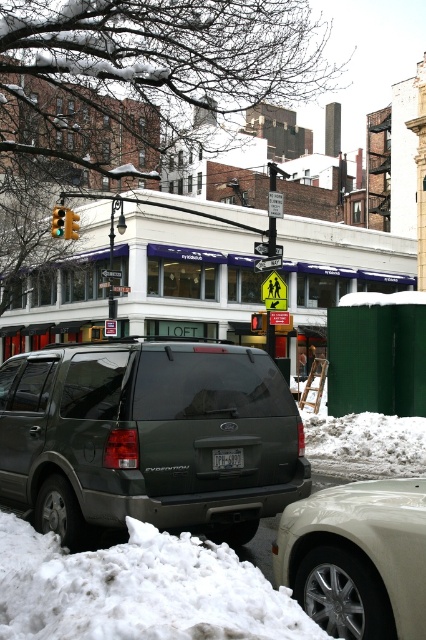
You are a delivery drone trying to deliver a package to the address on the black plastic license plate at rear. The GPS coordinates for the license plate are at point 0.717, 0.533. Can you confirm if this is the correct location to drop the package?

The black plastic license plate at rear is located at point (227,458), so the GPS coordinates are correct for dropping the package there.

You are standing on the sidewalk and want to take a photo of the matte gray suv at center. The camera you are using has a focal length of 50mm. If the suv is at coordinates 0.683 on the x and 0.350 on the y axis, what is the best position to stand to capture the entire vehicle in the frame?

The matte gray suv at center is located at point (149, 436). To capture the entire vehicle in the frame with a 50mm focal length, position yourself directly in front of the suv, aligning your camera with its center coordinates to ensure proper framing.